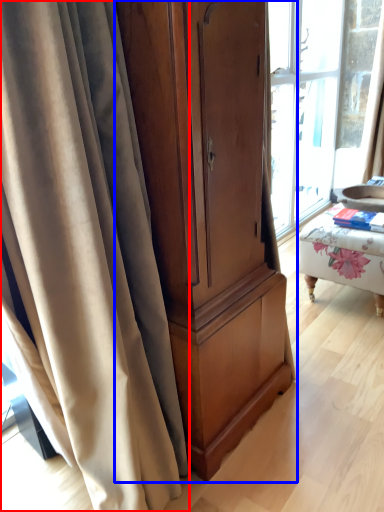
Question: Which point is closer to the camera, curtain (highlighted by a red box) or cabinetry (highlighted by a blue box)?

Choices:
 (A) curtain
 (B) cabinetry

Answer: (A)